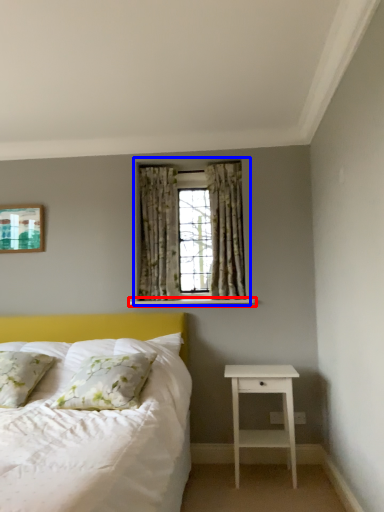
Question: Which object is closer to the camera taking this photo, window sill (highlighted by a red box) or window (highlighted by a blue box)?

Choices:
 (A) window sill
 (B) window

Answer: (A)